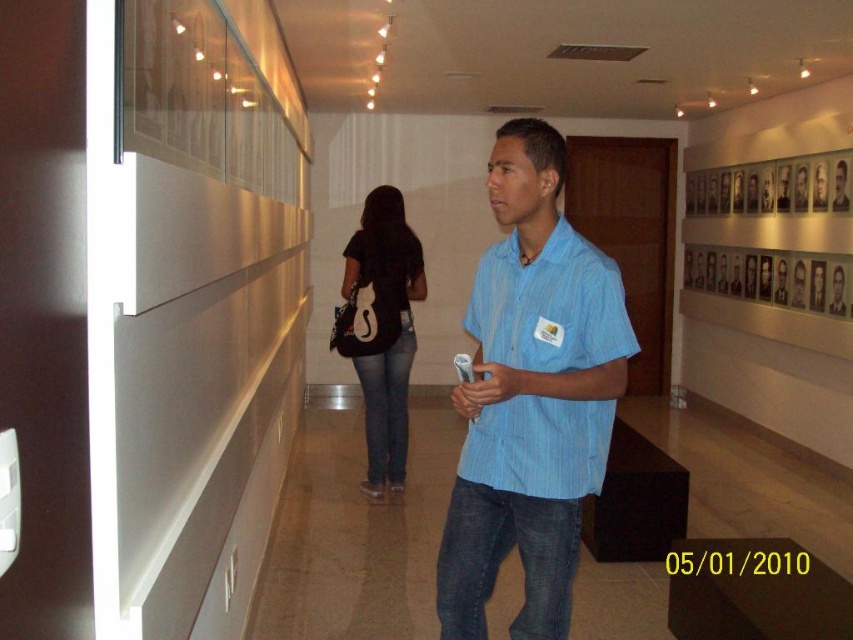
Question: Which of these objects is positioned closest to the black matte shirt at center?

Choices:
 (A) blue striped shirt at center
 (B) blue denim jeans at center
 (C) denim at center

Answer: (B)

Question: Can you confirm if blue striped shirt at center is wider than blue denim jeans at center?

Choices:
 (A) no
 (B) yes

Answer: (B)

Question: Considering the relative positions of blue striped shirt at center and blue denim jeans at center in the image provided, where is blue striped shirt at center located with respect to blue denim jeans at center?

Choices:
 (A) right
 (B) left

Answer: (A)

Question: Among these points, which one is farthest from the camera?

Choices:
 (A) (405, 420)
 (B) (486, 586)
 (C) (560, 524)

Answer: (A)

Question: Can you confirm if black matte shirt at center is positioned to the right of blue denim jeans at center?

Choices:
 (A) yes
 (B) no

Answer: (A)

Question: Based on their relative distances, which object is nearer to the denim at center?

Choices:
 (A) blue denim jeans at center
 (B) blue striped shirt at center

Answer: (B)